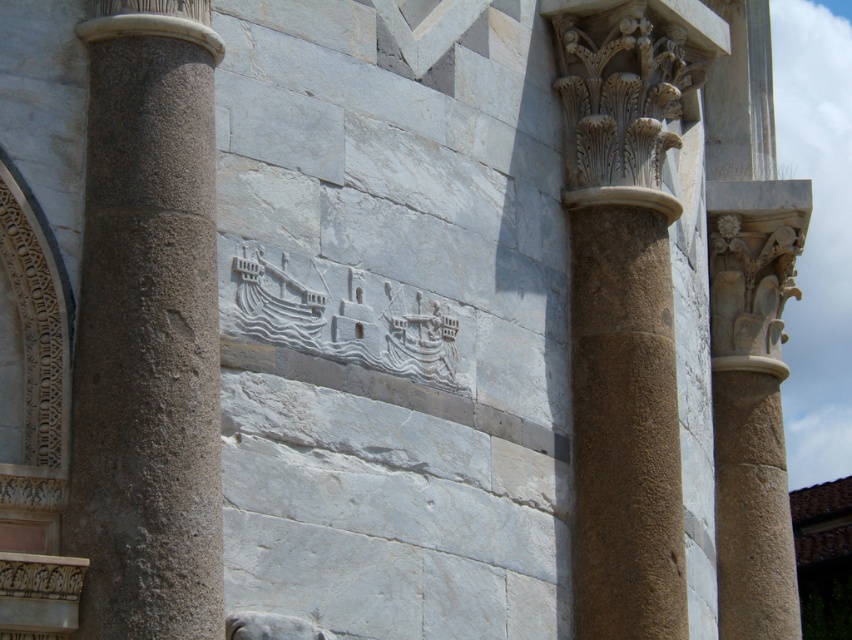
Question: Among these objects, which one is nearest to the camera?

Choices:
 (A) brown stone column at right
 (B) smooth stone column at upper right
 (C) gray stone column at left

Answer: (C)

Question: Where is brown stone column at right located in relation to smooth stone column at upper right in the image?

Choices:
 (A) above
 (B) below

Answer: (B)

Question: Which point is farther to the camera?

Choices:
 (A) gray stone column at left
 (B) brown stone column at right
 (C) smooth stone column at upper right

Answer: (C)

Question: Is gray stone column at left positioned behind brown stone column at right?

Choices:
 (A) yes
 (B) no

Answer: (B)

Question: In this image, where is gray stone column at left located relative to smooth stone column at upper right?

Choices:
 (A) below
 (B) above

Answer: (A)

Question: Which point is farther to the camera?

Choices:
 (A) smooth stone column at upper right
 (B) gray stone column at left
 (C) brown stone column at right

Answer: (A)